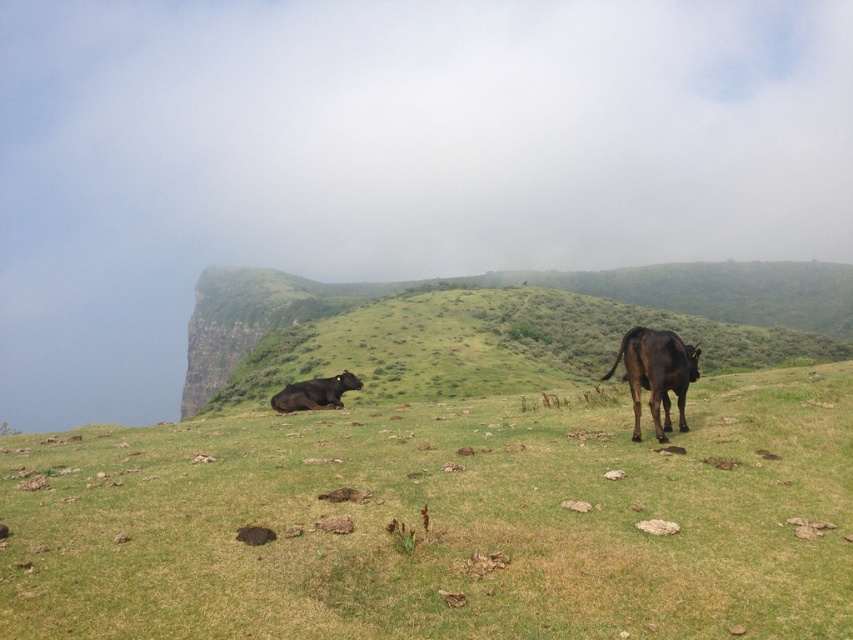
You are standing at point (316,404) in the pastoral scene. You want to move to the point (305,307). Which direction should you walk to reach your destination?

To reach point (305,307) from point (316,404), you should walk backward since point (305,307) is behind point (316,404).

You are a photographer positioned at the edge of the green grassy hillside at center and want to take a picture of the shiny black cow at center. Based on their positions, which direction should you move to get the cow in your frame?

The green grassy hillside at center is to the left of the shiny black cow at center, so you should move to the right to position yourself where the cow is centered in your frame.